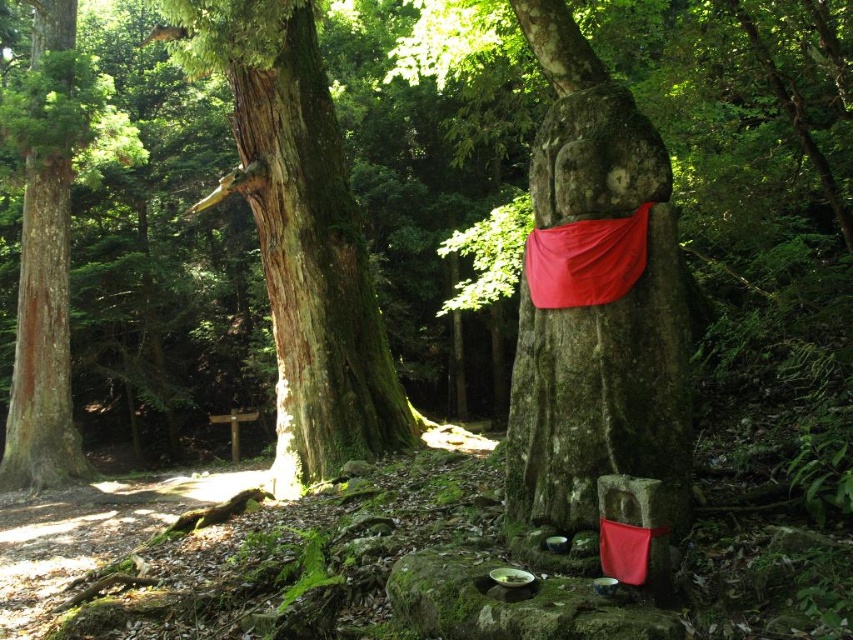
You are standing in the forest and want to place a small offering at the base of the green mossy tree at center. Based on the coordinates provided in the description, can you determine if the tree is positioned closer to the left or right side of the scene?

The green mossy tree at center is located at point (300, 236), which places it closer to the left side of the scene since the x coordinate is less than 0.5. Therefore, the tree is positioned closer to the left side.

You are a botanist studying the growth patterns of moss on statues. You have a measuring tool that can only reach up to 30 centimeters. Can you measure the distance between the green mossy stone statue at center and the red fabric at center without moving either object?

The distance between the green mossy stone statue at center and the red fabric at center is 30.30 centimeters, which is slightly longer than the measuring tool can reach. Therefore, you cannot measure the distance without moving either object.